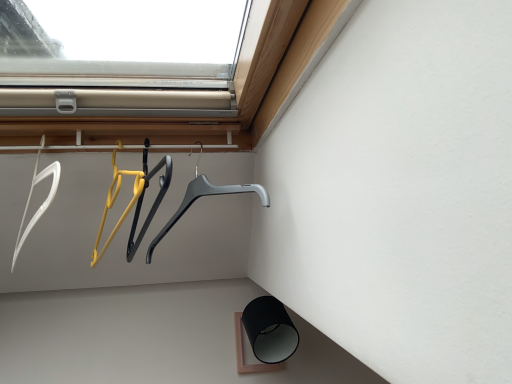
Question: Looking at their shapes, would you say white plastic hanger at left, placed as the second hanger when sorted from right to left, is wider or thinner than gray plastic hanger at center, arranged as the 2th hanger when viewed from the left?

Choices:
 (A) wide
 (B) thin

Answer: (B)

Question: Is white plastic hanger at left, the first hanger in the left-to-right sequence, taller or shorter than gray plastic hanger at center, acting as the 1th hanger starting from the right?

Choices:
 (A) short
 (B) tall

Answer: (B)

Question: Is white plastic hanger at left, placed as the second hanger when sorted from right to left, situated inside gray plastic hanger at center, arranged as the 2th hanger when viewed from the left, or outside?

Choices:
 (A) outside
 (B) inside

Answer: (A)

Question: From a real-world perspective, is gray plastic hanger at center, arranged as the 2th hanger when viewed from the left, above or below white plastic hanger at left, placed as the second hanger when sorted from right to left?

Choices:
 (A) below
 (B) above

Answer: (A)

Question: Is gray plastic hanger at center, arranged as the 2th hanger when viewed from the left, in front of or behind white plastic hanger at left, placed as the second hanger when sorted from right to left, in the image?

Choices:
 (A) behind
 (B) front

Answer: (A)

Question: Looking at the image, does gray plastic hanger at center, acting as the 1th hanger starting from the right, seem bigger or smaller compared to white plastic hanger at left, the first hanger in the left-to-right sequence?

Choices:
 (A) big
 (B) small

Answer: (A)

Question: Does point (156, 241) appear closer or farther from the camera than point (29, 193)?

Choices:
 (A) farther
 (B) closer

Answer: (A)